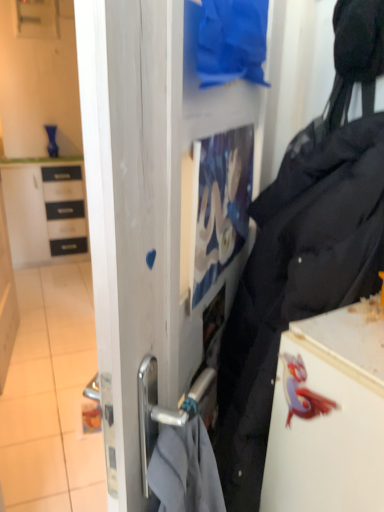
Question: From their relative heights in the image, would you say white glossy cabinet at left is taller or shorter than black matte tote bag at center-right?

Choices:
 (A) tall
 (B) short

Answer: (B)

Question: Would you say white glossy cabinet at left is to the left or to the right of black matte tote bag at center-right in the picture?

Choices:
 (A) left
 (B) right

Answer: (A)

Question: Which of these objects is positioned farthest from the white glossy fridge at lower right?

Choices:
 (A) transparent glass door at center
 (B) white glossy cabinet at left
 (C) black matte tote bag at center-right
 (D) white glossy tile at lower left
 (E) blue fabric at upper center

Answer: (B)

Question: Based on their relative distances, which object is nearer to the white glossy fridge at lower right?

Choices:
 (A) white glossy tile at lower left
 (B) blue fabric at upper center
 (C) white glossy cabinet at left
 (D) transparent glass door at center
 (E) black matte tote bag at center-right

Answer: (E)